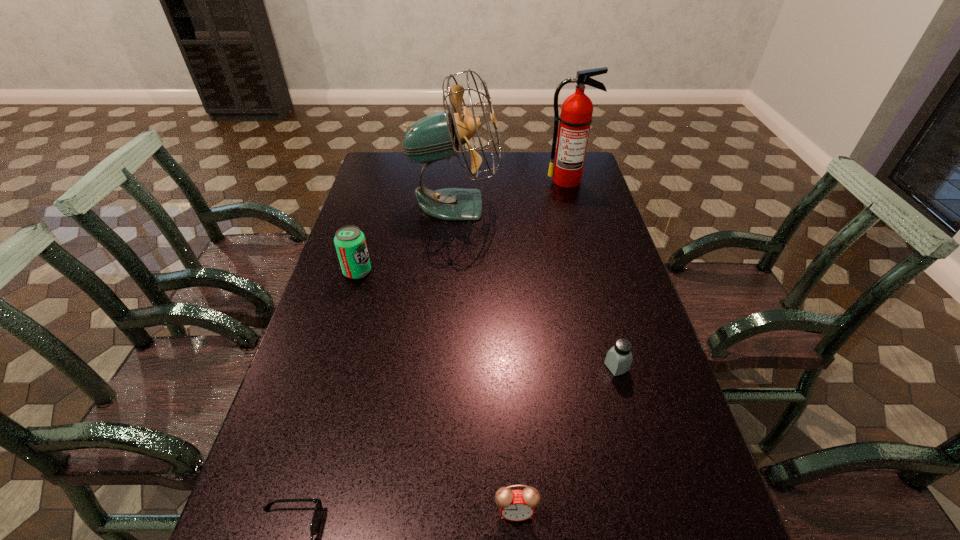
The width and height of the screenshot is (960, 540). Identify the location of fan. (436, 137).

Image resolution: width=960 pixels, height=540 pixels. Identify the location of fire extinguisher. (576, 117).

Where is `pop soda`? pop soda is located at coordinates [350, 243].

Image resolution: width=960 pixels, height=540 pixels. What are the coordinates of `the third farthest object` in the screenshot? It's located at (350, 243).

Image resolution: width=960 pixels, height=540 pixels. I want to click on alarm clock, so click(515, 505).

The height and width of the screenshot is (540, 960). What are the coordinates of `saltshaker` in the screenshot? It's located at (619, 358).

You are a GUI agent. You are given a task and a screenshot of the screen. Output one action in this format:
    pyautogui.click(x=<x>, y=<y>)
    Task: Click on the vacant space located 0.170m on the front-facing side of the fan for air flow
    
    Given the screenshot: What is the action you would take?
    pyautogui.click(x=547, y=205)

Locate an element on the screen. vacant space located 0.360m on the side of the fire extinguisher near the handle is located at coordinates (586, 248).

Identify the location of vacant region located 0.390m on the front-facing side of the pop soda. This screenshot has height=540, width=960. (500, 272).

You are a GUI agent. You are given a task and a screenshot of the screen. Output one action in this format:
    pyautogui.click(x=<x>, y=<y>)
    Task: Click on the free region located 0.130m on the front of the fourth farthest object
    The image size is (960, 540).
    Given the screenshot: What is the action you would take?
    pyautogui.click(x=633, y=427)